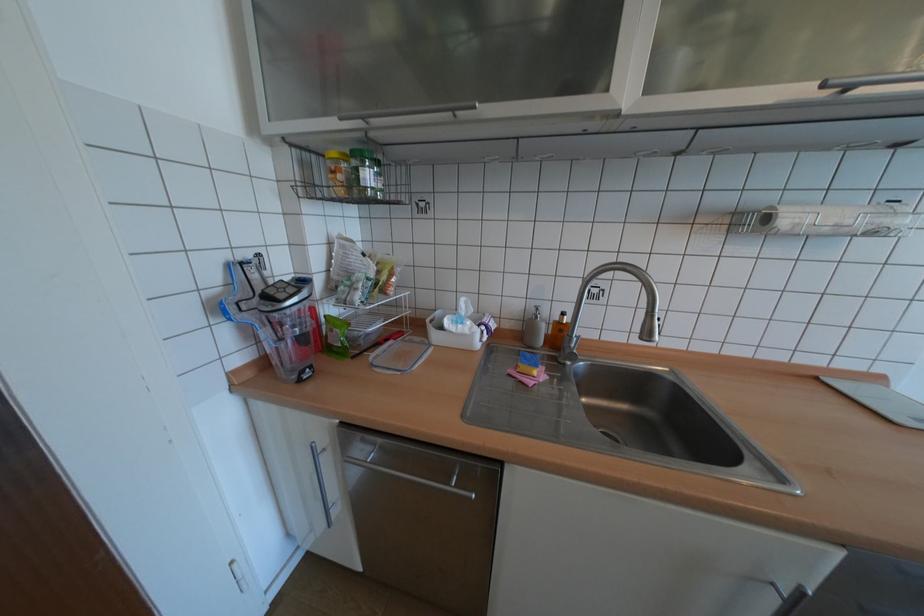
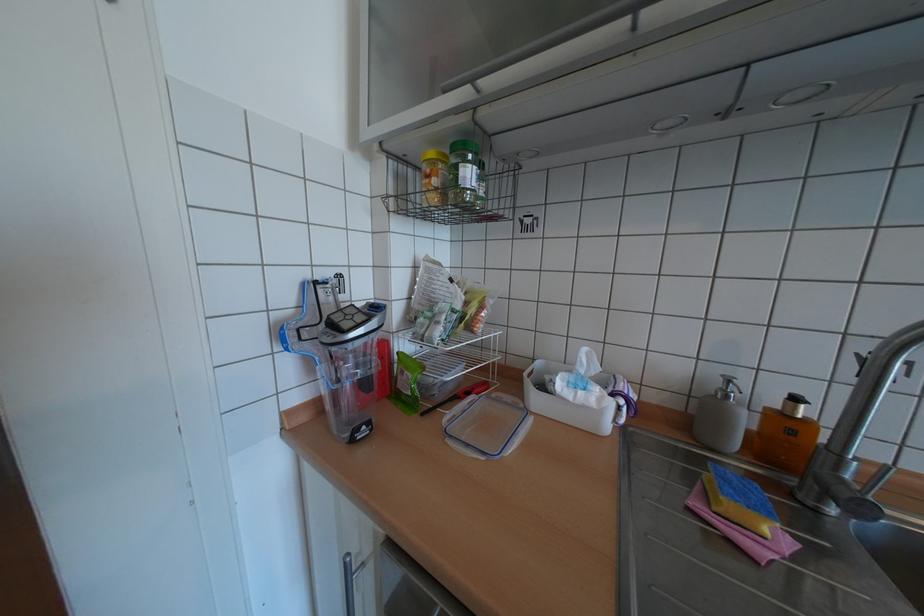
Where in the second image is the point corresponding to pixel 572 314 from the first image?

(805, 399)